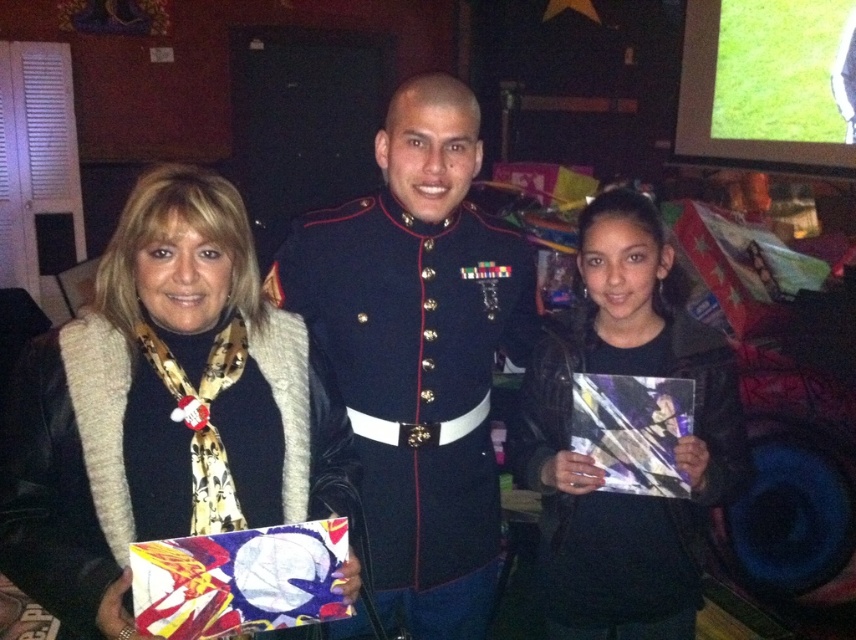
Between matte black jacket at left and black matte uniform at center, which one appears on the left side from the viewer's perspective?

Positioned to the left is matte black jacket at left.

In the scene shown: Can you confirm if matte black jacket at left is smaller than black matte uniform at center?

No, matte black jacket at left is not smaller than black matte uniform at center.

Does point (233, 406) come farther from viewer compared to point (690, 348)?

No, (233, 406) is in front of (690, 348).

Locate an element on the screen. matte black jacket at left is located at coordinates (162, 410).

Consider the image. Is matte black jacket at left bigger than navy blue fabric uniform at center?

No.

Does point (39, 568) come farther from viewer compared to point (364, 243)?

No, it is not.

Which is behind, point (21, 484) or point (482, 260)?

The point (482, 260) is more distant.

At what (x,y) coordinates should I click in order to perform the action: click on matte black jacket at left. Please return your answer as a coordinate pair (x, y). Looking at the image, I should click on (162, 410).

Between point (438, 250) and point (535, 454), which one is positioned in front?

Point (438, 250) is in front.

Is navy blue fabric uniform at center thinner than black matte uniform at center?

No.

Between point (399, 282) and point (736, 419), which one is positioned in front?

Point (399, 282)

This screenshot has height=640, width=856. I want to click on navy blue fabric uniform at center, so click(417, 387).